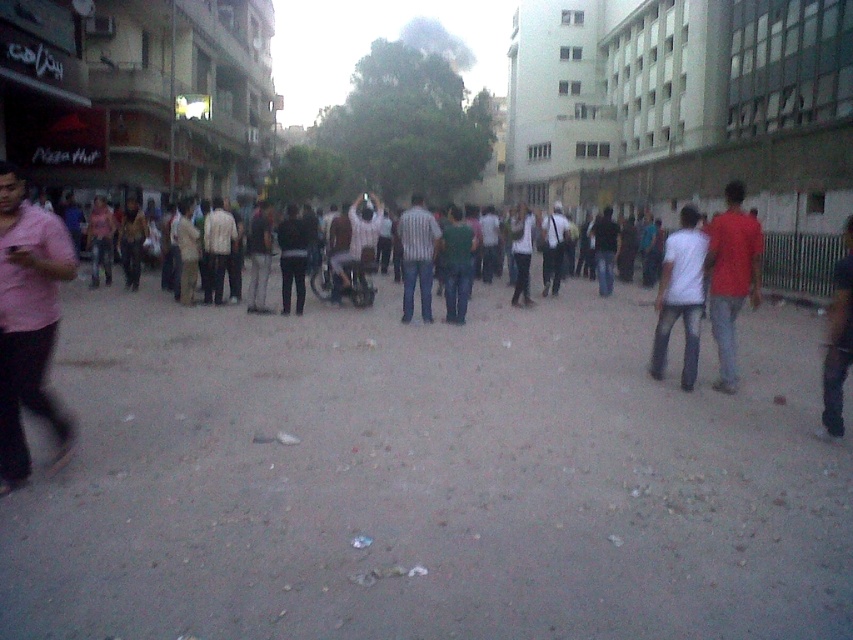
Question: Which object appears closest to the camera in this image?

Choices:
 (A) dark green shirt at center
 (B) red matte shirt at right

Answer: (B)

Question: Which point is farther to the camera?

Choices:
 (A) (602, 296)
 (B) (729, 339)
 (C) (422, 310)
 (D) (546, 228)

Answer: (A)

Question: Considering the real-world distances, which object is closest to the light brown shirt at center?

Choices:
 (A) pink matte shirt at left
 (B) red matte shirt at right
 (C) dark blue jeans at center

Answer: (A)

Question: Is light brown shirt at center smaller than dark green shirt at center?

Choices:
 (A) yes
 (B) no

Answer: (A)

Question: In this image, where is white shirt at center located relative to dark blue jeans at center?

Choices:
 (A) right
 (B) left

Answer: (B)

Question: Can you confirm if dark green shirt at center is thinner than dark blue jeans at center?

Choices:
 (A) yes
 (B) no

Answer: (B)